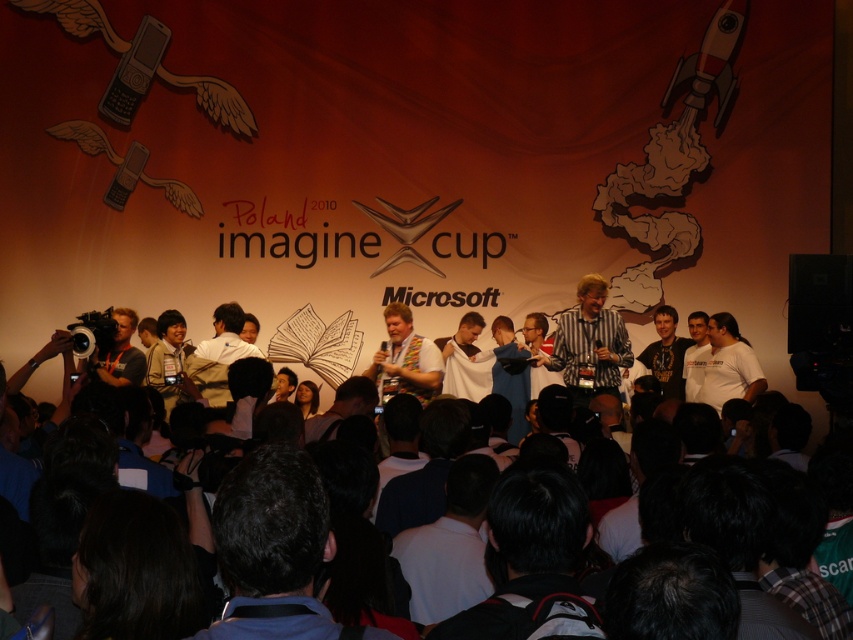
Does dark gray t-shirt at center have a smaller size compared to light brown shirt at center?

Indeed, dark gray t-shirt at center has a smaller size compared to light brown shirt at center.

Does point (660, 374) lie in front of point (209, 400)?

No.

Find the location of `dark gray t-shirt at center`. dark gray t-shirt at center is located at coordinates (666, 353).

Who is more distant from viewer, [469,481] or [216,320]?

Point [216,320]

Who is positioned more to the left, white shirt at center or light brown shirt at center?

light brown shirt at center

Who is more distant from viewer, (428, 584) or (238, 310)?

Point (238, 310)

Identify the location of white shirt at center. The image size is (853, 640). (450, 545).

Does dark blue fabric at center have a lesser height compared to white shirt at center?

Incorrect, dark blue fabric at center's height does not fall short of white shirt at center's.

Is point (224, 516) behind point (461, 493)?

That is False.

You are a GUI agent. You are given a task and a screenshot of the screen. Output one action in this format:
    pyautogui.click(x=<x>, y=<y>)
    Task: Click on the dark blue fabric at center
    
    Given the screenshot: What is the action you would take?
    pyautogui.click(x=274, y=548)